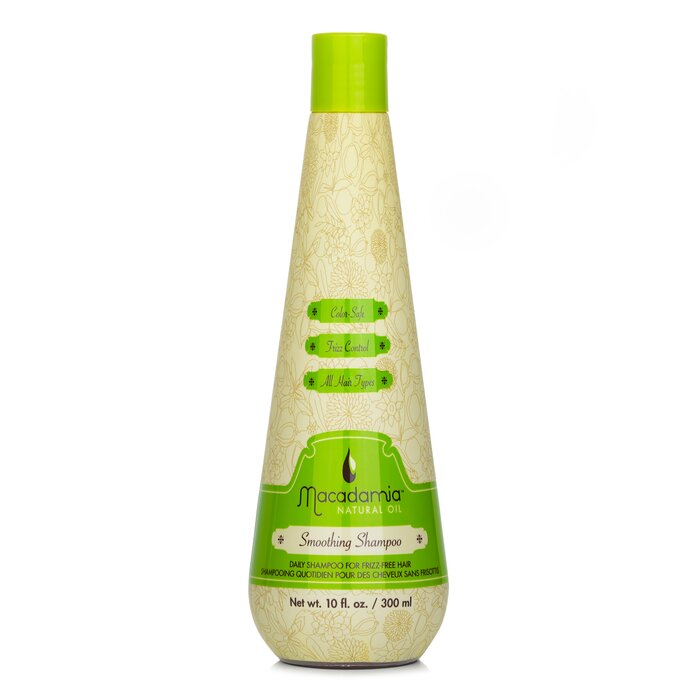
The image size is (700, 700). I want to click on bottle, so click(x=357, y=190).